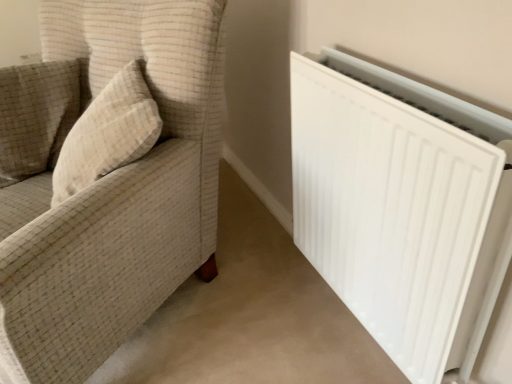
Question: Considering the relative positions of beige textured pillow at upper left and beige textured pillow at left in the image provided, is beige textured pillow at upper left to the left of beige textured pillow at left from the viewer's perspective?

Choices:
 (A) yes
 (B) no

Answer: (A)

Question: From the image's perspective, is beige textured pillow at upper left below beige textured pillow at left?

Choices:
 (A) yes
 (B) no

Answer: (B)

Question: Is beige textured pillow at left at the back of beige textured pillow at upper left?

Choices:
 (A) no
 (B) yes

Answer: (A)

Question: Does beige textured pillow at upper left have a greater height compared to beige textured pillow at left?

Choices:
 (A) yes
 (B) no

Answer: (A)

Question: Is beige textured pillow at upper left surrounding beige textured pillow at left?

Choices:
 (A) yes
 (B) no

Answer: (B)

Question: Choose the correct answer: Is beige textured pillow at upper left inside beige textured pillow at left or outside it?

Choices:
 (A) inside
 (B) outside

Answer: (B)

Question: Considering the positions of point (26, 96) and point (128, 62), is point (26, 96) closer or farther from the camera than point (128, 62)?

Choices:
 (A) closer
 (B) farther

Answer: (B)

Question: From the image's perspective, relative to beige textured pillow at left, is beige textured pillow at upper left above or below?

Choices:
 (A) below
 (B) above

Answer: (B)

Question: From a real-world perspective, is beige textured pillow at upper left physically located above or below beige textured pillow at left?

Choices:
 (A) above
 (B) below

Answer: (B)

Question: Is point (82, 185) positioned closer to the camera than point (65, 317)?

Choices:
 (A) closer
 (B) farther

Answer: (B)

Question: Would you say beige textured pillow at left is inside or outside white fabric couch at left?

Choices:
 (A) outside
 (B) inside

Answer: (B)

Question: In terms of height, does beige textured pillow at left look taller or shorter compared to white fabric couch at left?

Choices:
 (A) tall
 (B) short

Answer: (B)

Question: From a real-world perspective, is beige textured pillow at left above or below white fabric couch at left?

Choices:
 (A) below
 (B) above

Answer: (B)

Question: Is beige textured pillow at left inside or outside of white matte radiator at right?

Choices:
 (A) outside
 (B) inside

Answer: (A)

Question: From a real-world perspective, is beige textured pillow at left above or below white matte radiator at right?

Choices:
 (A) below
 (B) above

Answer: (B)